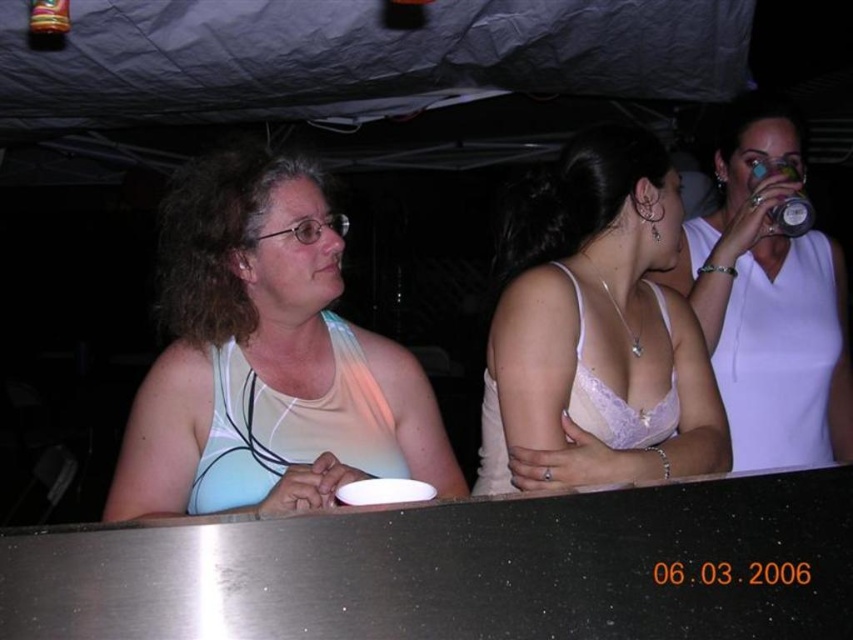
The height and width of the screenshot is (640, 853). Find the location of `white matte tank top at upper right`. white matte tank top at upper right is located at coordinates (769, 300).

Describe the element at coordinates (769, 300) in the screenshot. This screenshot has height=640, width=853. I see `white matte tank top at upper right` at that location.

Identify the location of white matte tank top at upper right. (769, 300).

The image size is (853, 640). In order to click on white matte tank top at upper right in this screenshot , I will do `click(769, 300)`.

Can you confirm if white matte tank top at left is wider than white matte bikini top at left?

Yes, white matte tank top at left is wider than white matte bikini top at left.

Between white matte tank top at left and white matte bikini top at left, which one has less height?

white matte bikini top at left is shorter.

Which is behind, point (248, 401) or point (354, 376)?

The point (354, 376) is behind.

This screenshot has width=853, height=640. I want to click on white matte tank top at left, so click(x=265, y=358).

Can you confirm if white matte tank top at upper right is positioned below white matte bikini top at left?

No.

Is white matte tank top at upper right smaller than white matte bikini top at left?

Incorrect, white matte tank top at upper right is not smaller in size than white matte bikini top at left.

Find the location of a particular element. The height and width of the screenshot is (640, 853). white matte tank top at upper right is located at coordinates (769, 300).

This screenshot has height=640, width=853. What are the coordinates of `white matte tank top at upper right` in the screenshot? It's located at (769, 300).